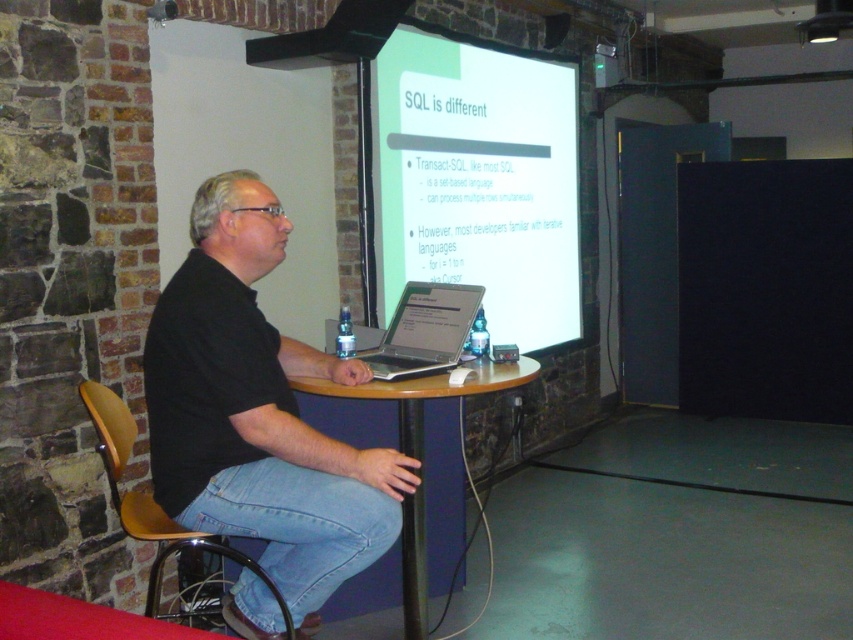
You are a person who is 1.8 meters tall. You are standing in front of the brown wood chair at left. The chair is 2.05 meters away from you. If you want to sit down, will your knees hit the chair before you reach the seat?

The distance between you and the brown wood chair at left is 2.05 meters. Since the average person requires about 0.5 meters of space to sit comfortably without knee contact, there is sufficient space. Your knees will not hit the chair before reaching the seat.

You are a presenter standing in front of the white glossy projector screen at upper center and the black glass table at center. Which object is closer to you?

The white glossy projector screen at upper center is closer to you because it is further to the viewer than the black glass table at center.

You are a person who is 1.8 meters tall and want to sit on the brown wood chair at left to view the silver metallic laptop at center. Considering the chair height, will your feet touch the ground?

The brown wood chair at left is much taller than the silver metallic laptop at center. Since the chair is significantly taller, your feet may not touch the ground when sitting on it, as the seat height might be too elevated for someone of your height.